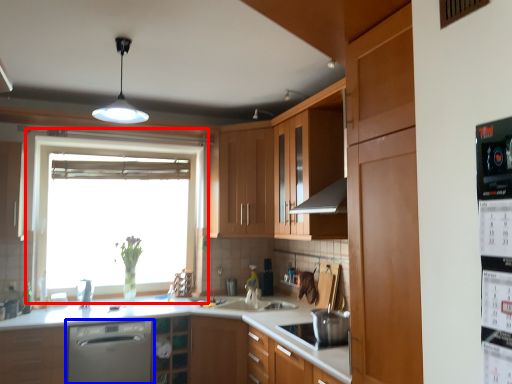
Question: Which object appears closest to the camera in this image, window (highlighted by a red box) or home appliance (highlighted by a blue box)?

Choices:
 (A) window
 (B) home appliance

Answer: (B)